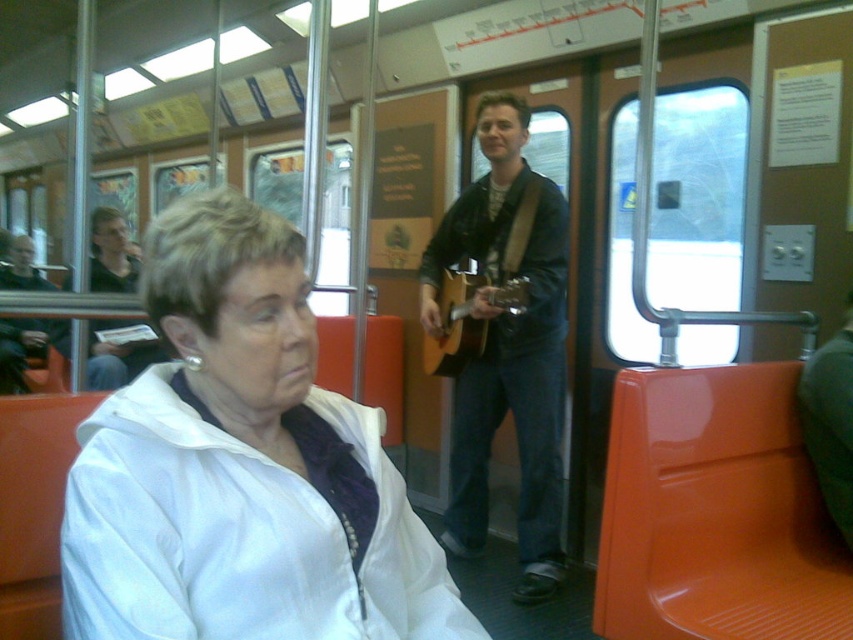
Question: Is white matte jacket at center wider than acoustic wood guitar at center?

Choices:
 (A) yes
 (B) no

Answer: (A)

Question: Among these points, which one is farthest from the camera?

Choices:
 (A) (457, 528)
 (B) (463, 314)

Answer: (A)

Question: Does matte brown guitar at center appear on the right side of acoustic wood guitar at center?

Choices:
 (A) yes
 (B) no

Answer: (A)

Question: Which point appears closest to the camera in this image?

Choices:
 (A) (424, 356)
 (B) (349, 476)

Answer: (B)

Question: Can you confirm if matte brown guitar at center is positioned to the left of acoustic wood guitar at center?

Choices:
 (A) no
 (B) yes

Answer: (A)

Question: Which object is closer to the camera taking this photo?

Choices:
 (A) acoustic wood guitar at center
 (B) matte brown guitar at center

Answer: (A)